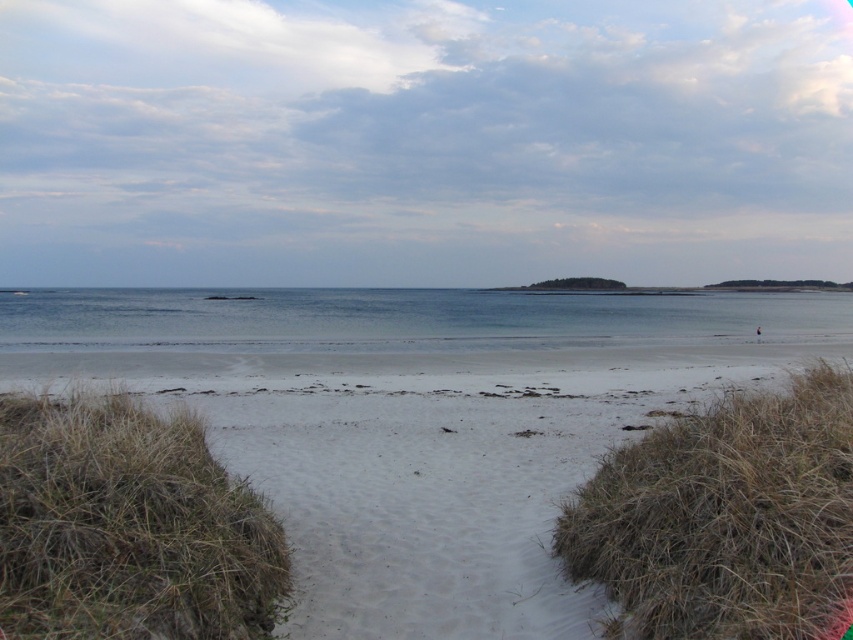
You are standing on the white sand at center and want to walk towards the clear blue water at center. Is the water above or below you?

The white sand at center is located below the clear blue water at center, so the water is above you.

You are standing at the edge of the beach and want to place a small seashell exactly where the white sand at center and clear blue water at center meet. Based on their sizes, which object will the seashell be closer to?

The white sand at center is smaller than clear blue water at center, so the seashell will be closer to the white sand at center since it occupies less area.